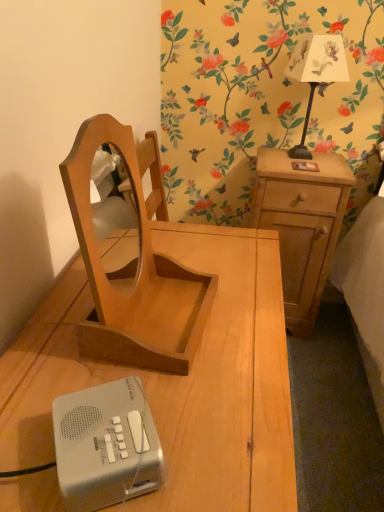
The height and width of the screenshot is (512, 384). I want to click on empty space that is to the right of white paper lampshade at upper right, so click(331, 163).